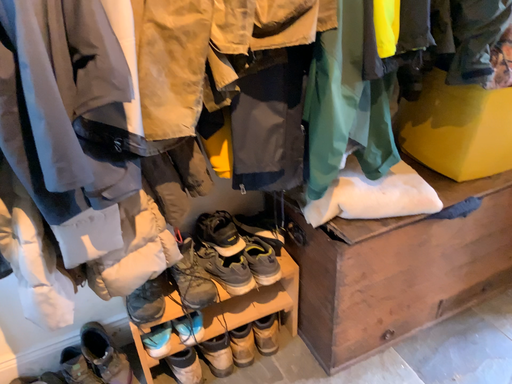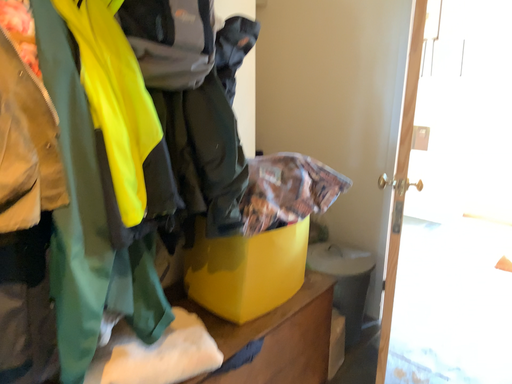
Question: Which way did the camera rotate in the video?

Choices:
 (A) rotated right
 (B) rotated left

Answer: (A)